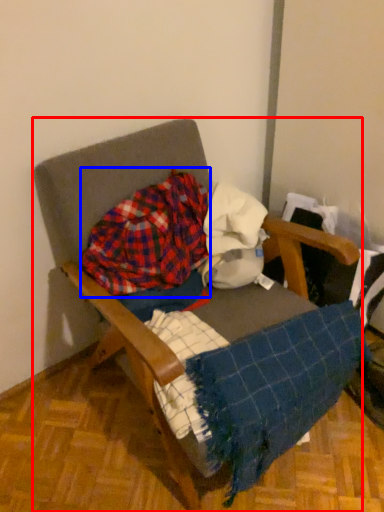
Question: Which point is further to the camera, furniture (highlighted by a red box) or flannel (highlighted by a blue box)?

Choices:
 (A) furniture
 (B) flannel

Answer: (B)